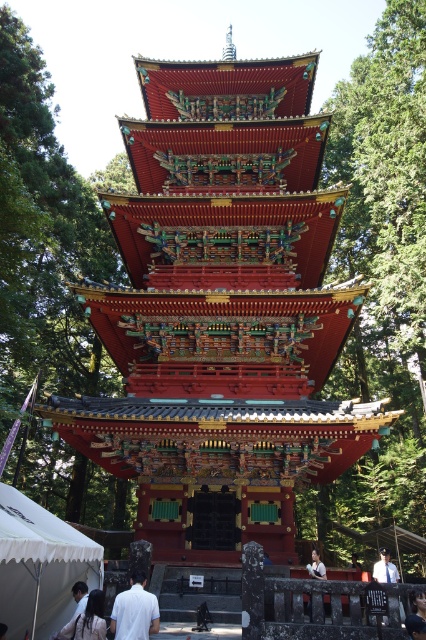
You are standing in front of the pagoda and notice a white cotton shirt at lower left and a dark blue fabric cap at lower right. Which object is positioned higher in the scene?

The white cotton shirt at lower left is located above the dark blue fabric cap at lower right, so it is positioned higher in the scene.

You are standing in front of the Japanese pagoda surrounded by greenery. You notice two points marked in the scene. The first point is at coordinates point (94, 605) and the second is at point (377, 566). Which point is closer to you?

Point (94, 605) is in front of point (377, 566), so it is closer to you.

You are a photographer planning to take a photo of the pagoda. You notice a white cotton shirt at lower left and a dark blue fabric cap at lower right in the foreground. Which item should you move to avoid blocking the pagoda? Explain your reasoning.

The white cotton shirt at lower left is positioned on the left side of the dark blue fabric cap at lower right. To avoid blocking the pagoda, you should move the white cotton shirt at lower left since it is closer to the left edge of the frame, potentially obscuring the pagoda if left in place.